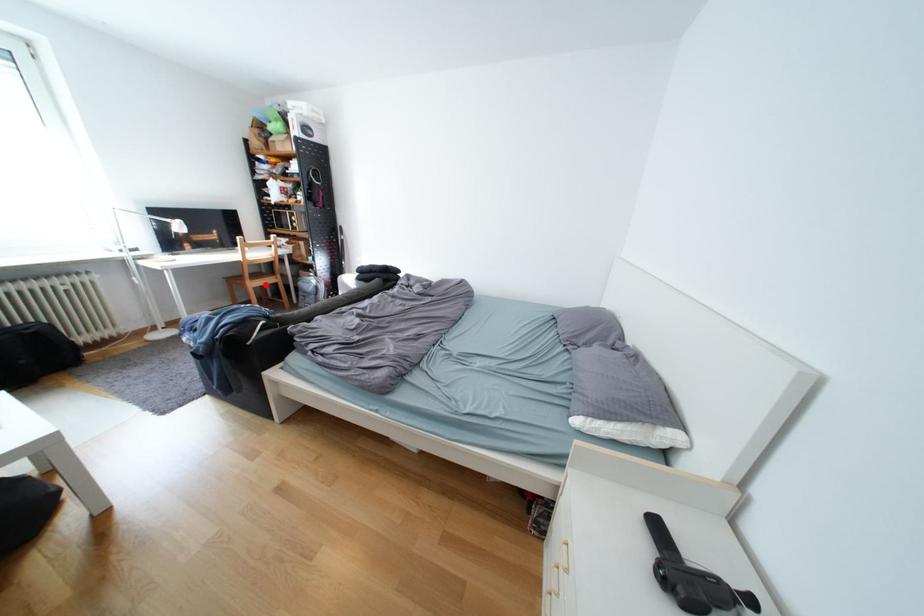
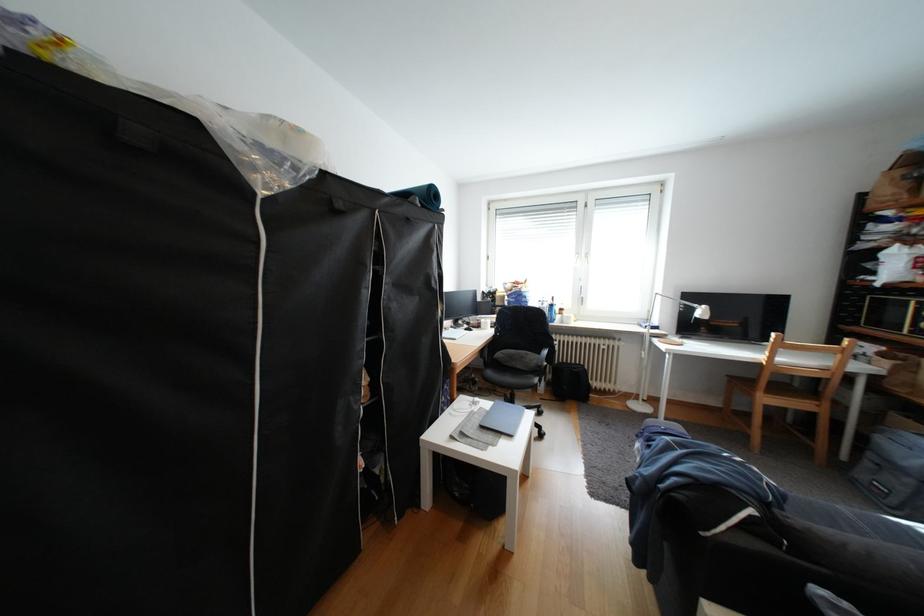
Question: I am providing you with two images of the same scene from different viewpoints. Given a red point in image1, look at the same physical point in image2. Is it:

Choices:
 (A) Closer to the viewpoint
 (B) Farther from the viewpoint

Answer: (B)